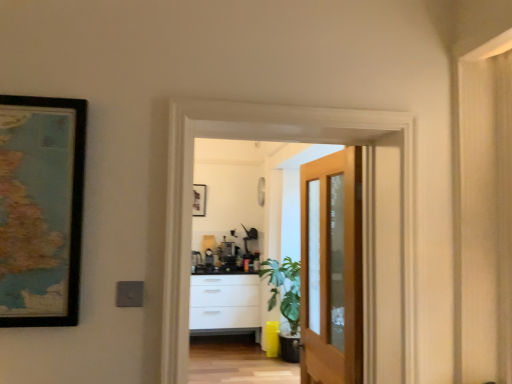
Question: In the image, is wooden floor at lower center positioned in front of or behind light brown wooden door at center?

Choices:
 (A) front
 (B) behind

Answer: (B)

Question: From a real-world perspective, is wooden floor at lower center positioned above or below light brown wooden door at center?

Choices:
 (A) below
 (B) above

Answer: (A)

Question: Which object is positioned farthest from the light brown wooden door at center?

Choices:
 (A) wooden screen door at center
 (B) wooden-framed map at left
 (C) wooden floor at lower center

Answer: (C)

Question: Estimate the real-world distances between objects in this image. Which object is closer to the wooden floor at lower center?

Choices:
 (A) wooden screen door at center
 (B) light brown wooden door at center
 (C) wooden-framed map at left

Answer: (B)